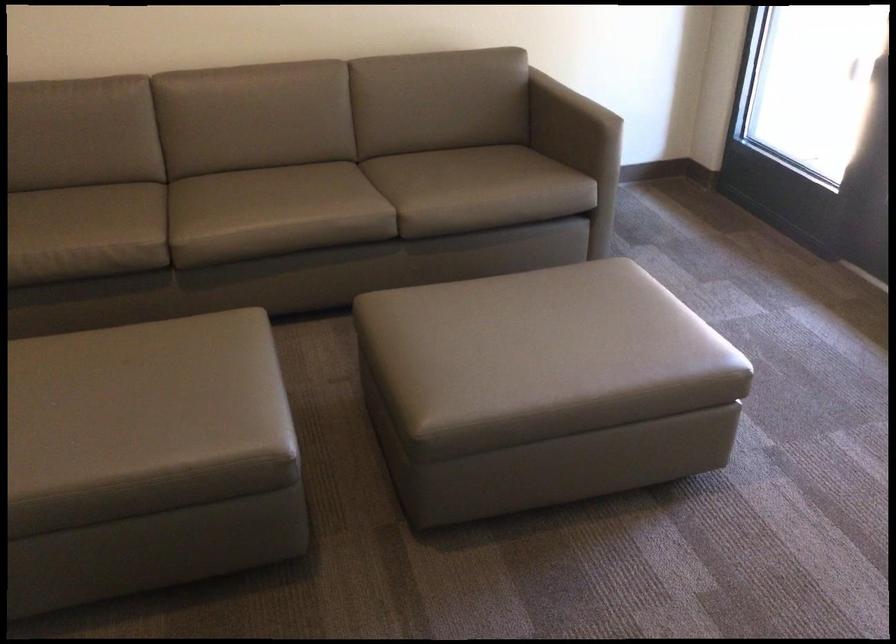
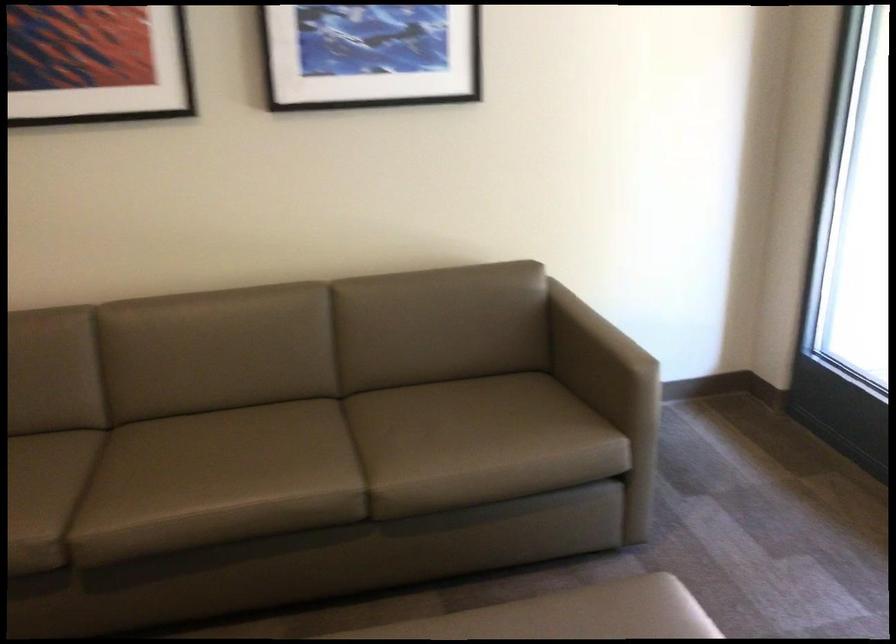
Where in the second image is the point corresponding to point (566, 275) from the first image?

(597, 618)